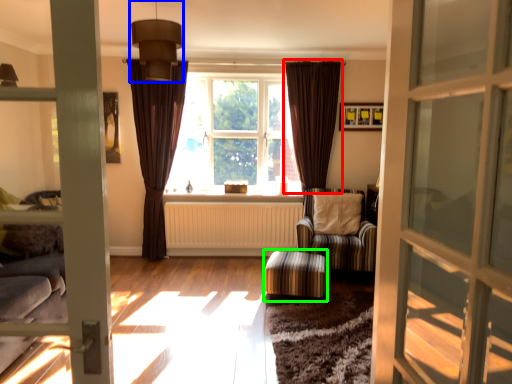
Question: Considering the real-world distances, which object is farthest from curtain (highlighted by a red box)? light fixture (highlighted by a blue box) or stool (highlighted by a green box)?

Choices:
 (A) light fixture
 (B) stool

Answer: (A)